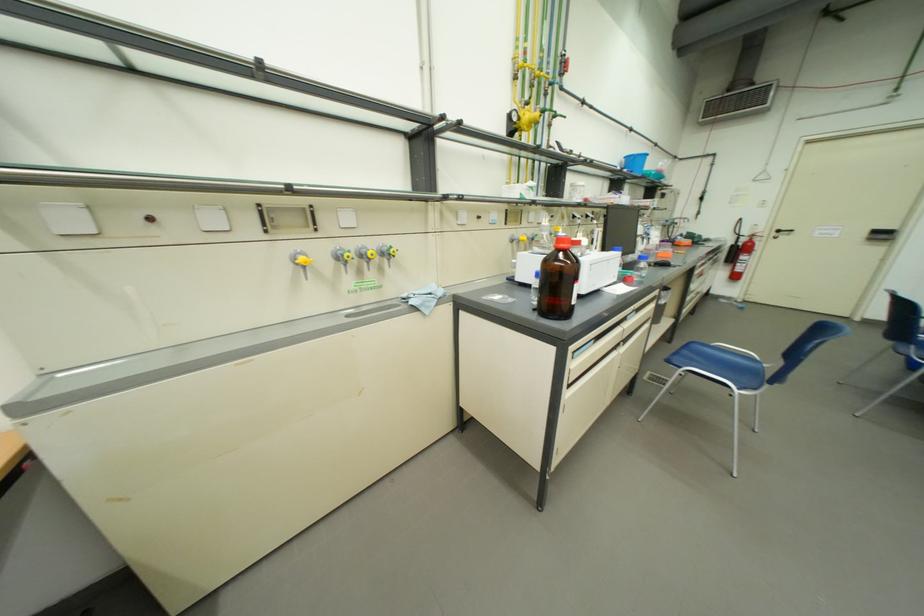
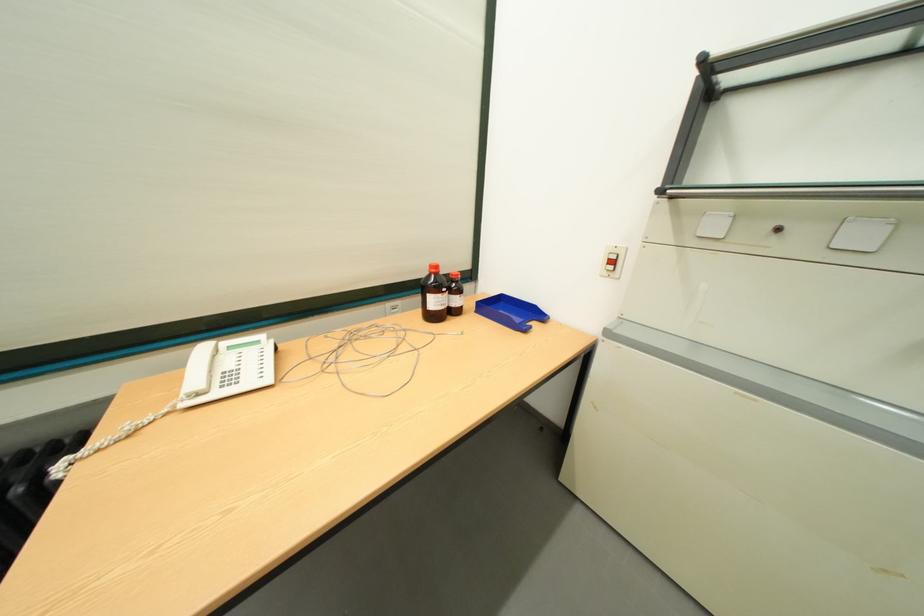
First-person continuous shooting, in which direction is the camera rotating?

The camera's rotation is toward left-down.